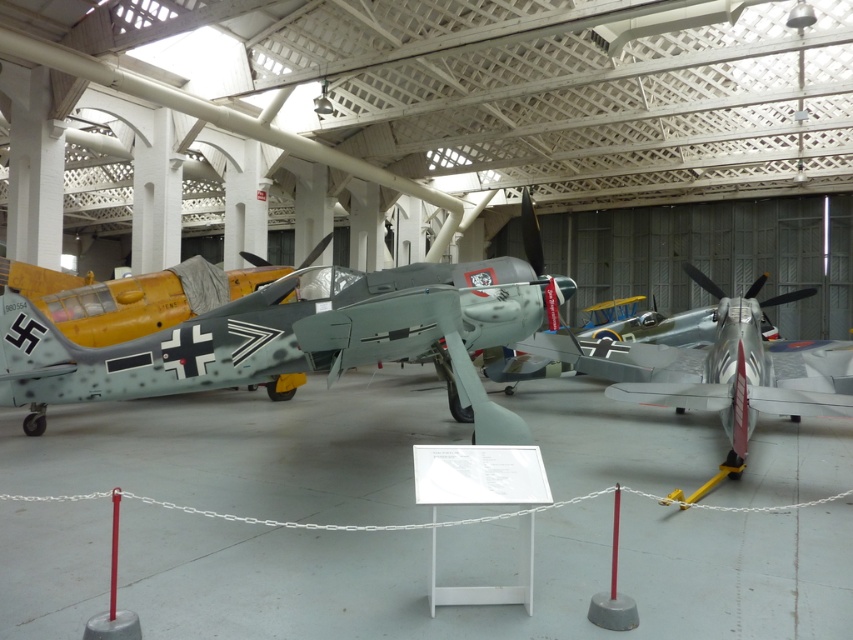
Can you confirm if silver metallic airplane at center is wider than camouflage paint airplane at left?

Incorrect, silver metallic airplane at center's width does not surpass camouflage paint airplane at left's.

This screenshot has width=853, height=640. In order to click on silver metallic airplane at center in this screenshot , I will do tap(718, 369).

You are a GUI agent. You are given a task and a screenshot of the screen. Output one action in this format:
    pyautogui.click(x=<x>, y=<y>)
    Task: Click on the silver metallic airplane at center
    This screenshot has height=640, width=853.
    Given the screenshot: What is the action you would take?
    pyautogui.click(x=718, y=369)